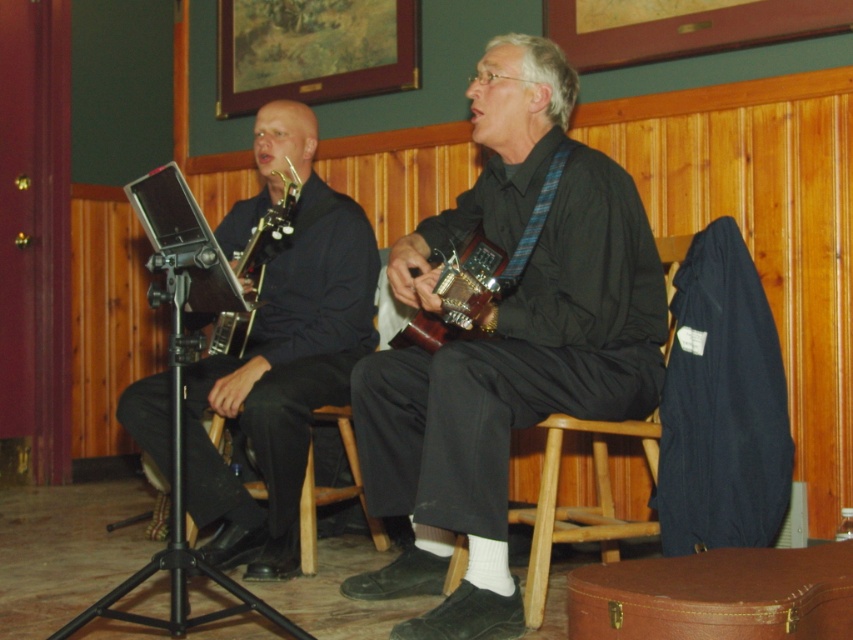
Question: Which of these objects is positioned closest to the wooden at center?

Choices:
 (A) metallic gold guitar at center
 (B) matte black guitar at center
 (C) matte black saxophone at center

Answer: (B)

Question: Can you confirm if wooden at center is thinner than wooden acoustic guitar at center?

Choices:
 (A) no
 (B) yes

Answer: (A)

Question: Which point appears closest to the camera in this image?

Choices:
 (A) (485, 388)
 (B) (338, 362)

Answer: (A)

Question: Does wooden at center lie in front of wooden acoustic guitar at center?

Choices:
 (A) no
 (B) yes

Answer: (A)

Question: Does matte black saxophone at center have a greater width compared to wooden acoustic guitar at center?

Choices:
 (A) no
 (B) yes

Answer: (B)

Question: Which point is farther from the camera taking this photo?

Choices:
 (A) (532, 100)
 (B) (252, 196)
 (C) (225, 346)
 (D) (479, 241)

Answer: (B)